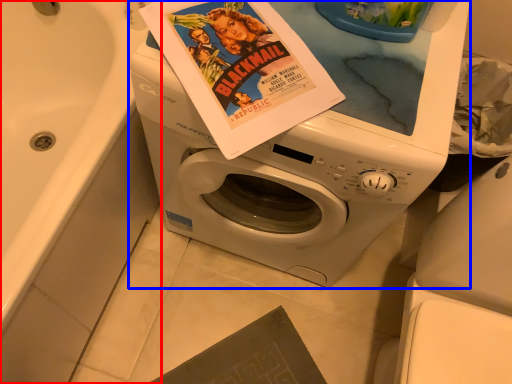
Question: Among these objects, which one is nearest to the camera, bath (highlighted by a red box) or washing machine (highlighted by a blue box)?

Choices:
 (A) bath
 (B) washing machine

Answer: (A)